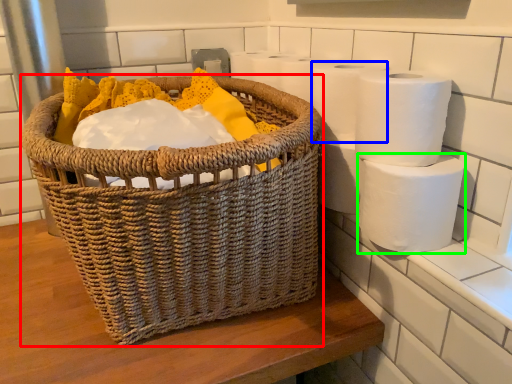
Question: Estimate the real-world distances between objects in this image. Which object is closer to picnic basket (highlighted by a red box), toilet paper (highlighted by a blue box) or toilet paper (highlighted by a green box)?

Choices:
 (A) toilet paper
 (B) toilet paper

Answer: (A)